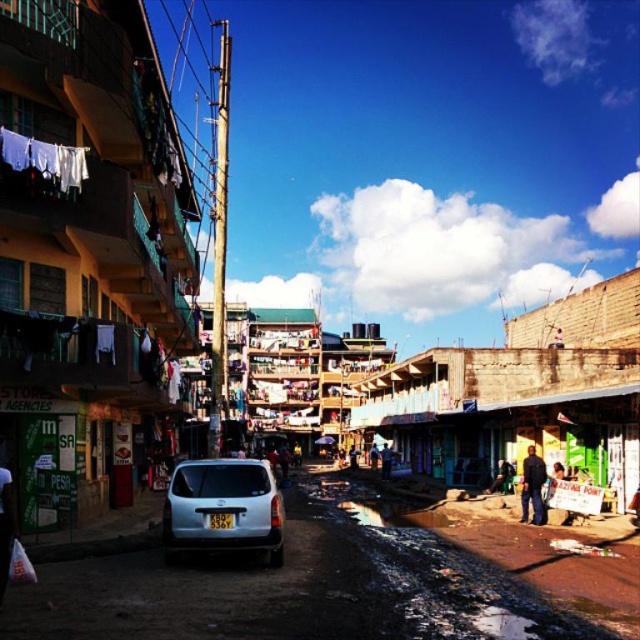
Question: Among these objects, which one is farthest from the camera?

Choices:
 (A) white fabric at lower left
 (B) satin silver suv at center
 (C) white matte car at center
 (D) dark blue jeans at lower right

Answer: (D)

Question: Can you confirm if white fabric at lower left is positioned to the left of dark blue jeans at lower right?

Choices:
 (A) no
 (B) yes

Answer: (B)

Question: Where is white matte car at center located in relation to dark blue jeans at lower right in the image?

Choices:
 (A) left
 (B) right

Answer: (A)

Question: Which point is closer to the camera?

Choices:
 (A) white fabric at lower left
 (B) satin silver suv at center
 (C) dark blue jeans at lower right

Answer: (A)

Question: Is white matte car at center to the left of white fabric at lower left from the viewer's perspective?

Choices:
 (A) yes
 (B) no

Answer: (B)

Question: Which of the following is the farthest from the observer?

Choices:
 (A) (358, 502)
 (B) (529, 456)
 (C) (17, 506)
 (D) (282, 532)

Answer: (A)